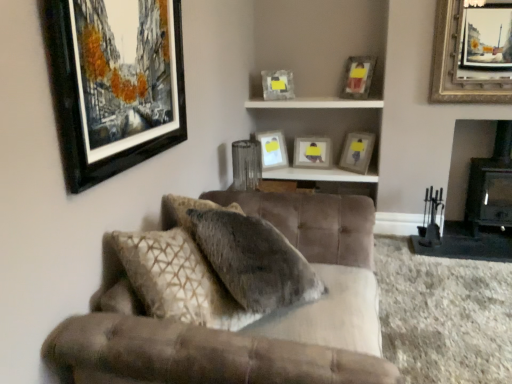
Question: Is matte gray picture frame at center, acting as the seventh picture frame starting from the front, to the left or to the right of matte white picture frame at upper center, which is the 2th picture frame from back to front, in the image?

Choices:
 (A) left
 (B) right

Answer: (B)

Question: Is point (322, 142) closer or farther from the camera than point (266, 142)?

Choices:
 (A) closer
 (B) farther

Answer: (A)

Question: Estimate the real-world distances between objects in this image. Which object is farther from the gold-framed painting at upper right, the first picture frame positioned from the right?

Choices:
 (A) matte white picture frame at upper center, acting as the sixth picture frame starting from the front
 (B) matte gray picture frame at upper right, the 6th picture frame viewed from the left
 (C) matte glass picture frame at upper center, marked as the 3th picture frame in a left-to-right arrangement
 (D) matte wooden picture frame at upper right, the 3th picture frame in the right-to-left sequence
 (E) white glossy shelf at upper center

Answer: (A)

Question: Estimate the real-world distances between objects in this image. Which object is farther from the matte glass picture frame at upper center, acting as the 5th picture frame starting from the front?

Choices:
 (A) matte gray picture frame at center, the 4th picture frame from the left
 (B) matte wooden picture frame at upper right, acting as the third picture frame starting from the front
 (C) wooden shelf at upper center
 (D) gold-framed painting at upper right, the sixth picture frame positioned from the back
 (E) white glossy shelf at upper center

Answer: (D)